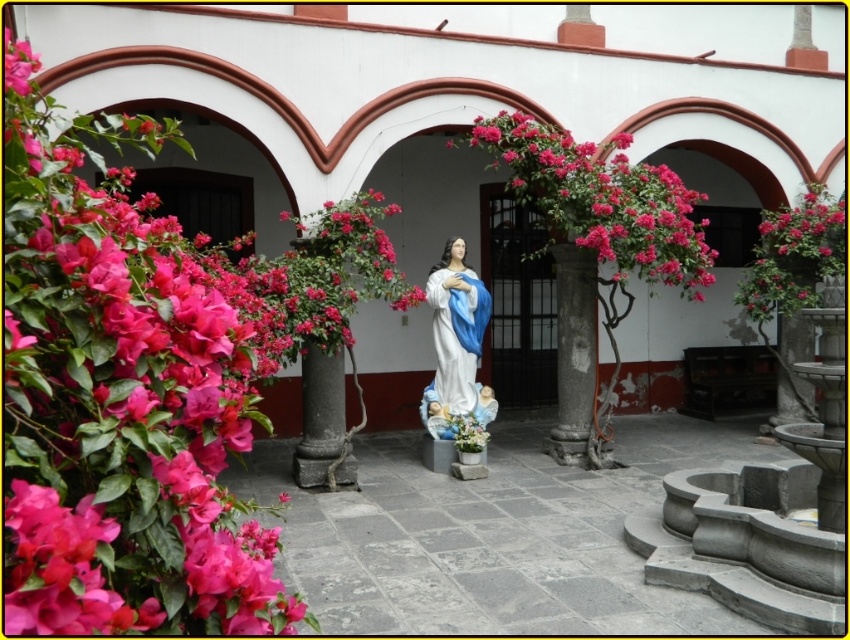
Is pink matte flowers at center to the left of pink matte flowers at upper right from the viewer's perspective?

Correct, you'll find pink matte flowers at center to the left of pink matte flowers at upper right.

Is pink matte flowers at center bigger than pink matte flowers at upper right?

Indeed, pink matte flowers at center has a larger size compared to pink matte flowers at upper right.

Is point (632, 230) more distant than point (799, 252)?

No.

In order to click on pink matte flowers at center in this screenshot , I will do `click(602, 200)`.

Can you confirm if pink matte flowers at center is thinner than white glossy statue at center?

No.

Can you confirm if pink matte flowers at center is shorter than white glossy statue at center?

Correct, pink matte flowers at center is not as tall as white glossy statue at center.

Locate an element on the screen. pink matte flowers at center is located at coordinates (602, 200).

Find the location of a particular element. pink matte flowers at center is located at coordinates (602, 200).

Looking at this image, which is below, white glossy statue at center or pink matte flowers at upper right?

Positioned lower is white glossy statue at center.

Who is positioned more to the left, white glossy statue at center or pink matte flowers at upper right?

white glossy statue at center is more to the left.

Who is more distant from viewer, (x=463, y=388) or (x=809, y=243)?

Point (x=809, y=243)

Where is `white glossy statue at center`? This screenshot has width=850, height=640. white glossy statue at center is located at coordinates (456, 340).